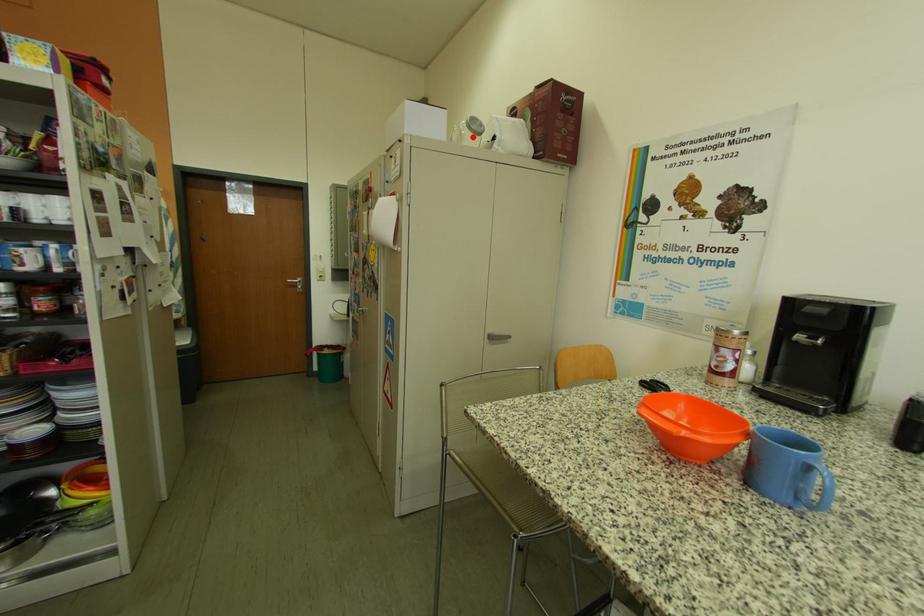
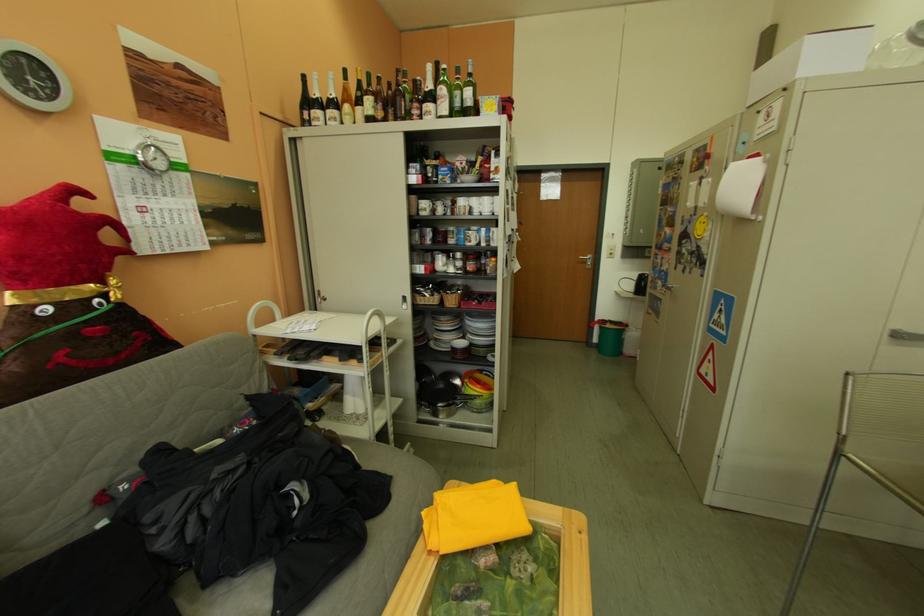
In the second image, find the point that corresponds to the highlighted location in the first image.

(904, 55)